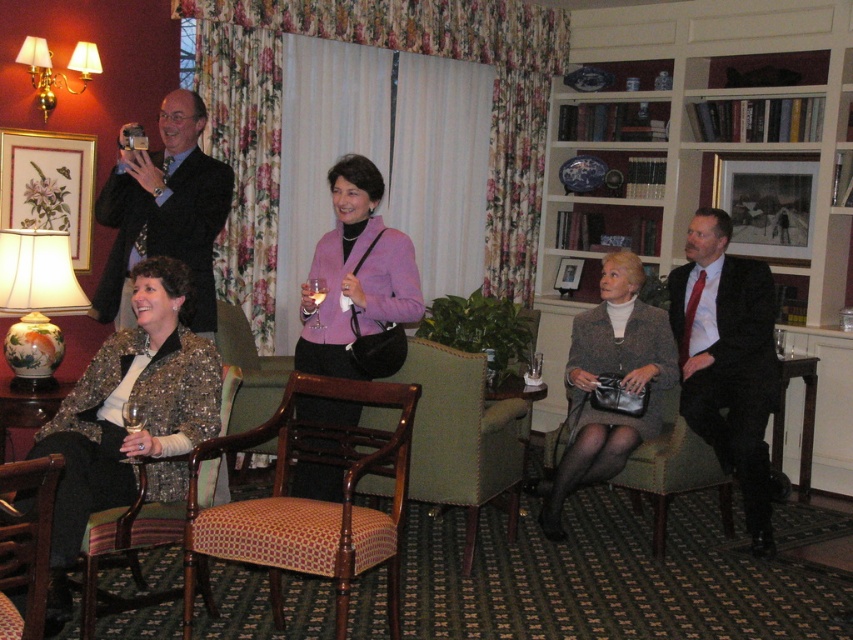
I want to click on wooden table at lower right, so click(802, 416).

Does wooden table at lower right have a lesser width compared to wooden table at center?

In fact, wooden table at lower right might be wider than wooden table at center.

Is point (808, 436) positioned after point (514, 376)?

Yes.

Image resolution: width=853 pixels, height=640 pixels. I want to click on wooden table at lower right, so click(x=802, y=416).

Is green fabric armchair at center closer to the viewer compared to wooden armchair at lower left?

No, it is behind wooden armchair at lower left.

Is point (468, 420) farther from camera compared to point (22, 570)?

Yes, it is.

Where is `green fabric armchair at center`? Image resolution: width=853 pixels, height=640 pixels. green fabric armchair at center is located at coordinates [462, 436].

Between patterned fabric armchair at center and wooden side table at lower left, which one appears on the left side from the viewer's perspective?

wooden side table at lower left

Consider the image. Can you confirm if patterned fabric armchair at center is positioned to the right of wooden side table at lower left?

Indeed, patterned fabric armchair at center is positioned on the right side of wooden side table at lower left.

Where is `patterned fabric armchair at center`? patterned fabric armchair at center is located at coordinates (310, 499).